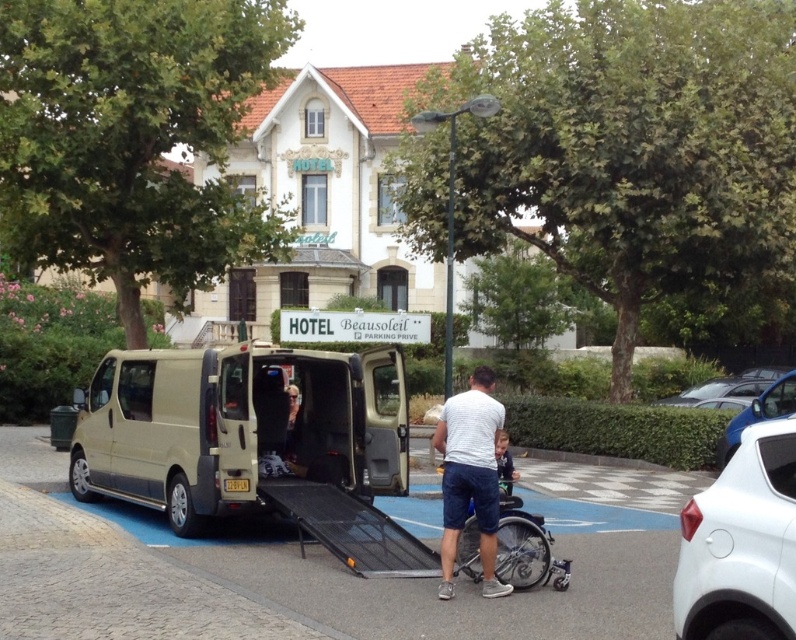
You are a delivery person who needs to park your van between the white glossy car at right and the metallic blue sedan at center right. The van is 6 meters long. Can you safely park your van in this space without overlapping either vehicle?

The distance between the white glossy car at right and the metallic blue sedan at center right is 5.79 meters. Since the van is 6 meters long, it cannot be parked safely in this space without overlapping either vehicle.

You are a hotel guest arriving at the Beausoleil hotel and need to park your car. You see the silver metallic wheelchair at lower center and the white glossy car at right. Where should you park your car to avoid blocking the wheelchair ramp?

You should park your car away from the white glossy car at right because the silver metallic wheelchair at lower center is positioned under it, indicating that the area near the white glossy car at right is being used for wheelchair access and should not be obstructed.